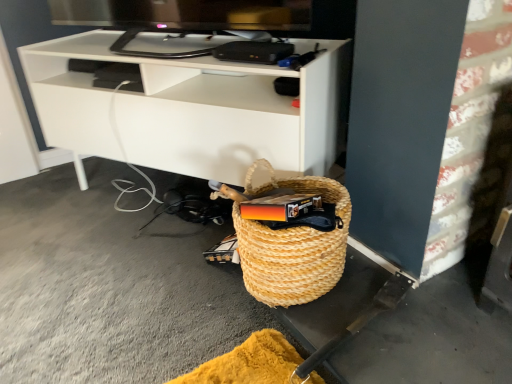
Question: Relative to white matte shelf at center, is woven straw basket at lower right in front or behind?

Choices:
 (A) behind
 (B) front

Answer: (B)

Question: Considering the positions of woven straw basket at lower right and white matte shelf at center in the image, is woven straw basket at lower right taller or shorter than white matte shelf at center?

Choices:
 (A) tall
 (B) short

Answer: (B)

Question: Is woven straw basket at lower right bigger or smaller than white matte shelf at center?

Choices:
 (A) big
 (B) small

Answer: (B)

Question: From the image's perspective, is white matte shelf at center above or below woven straw basket at lower right?

Choices:
 (A) above
 (B) below

Answer: (A)

Question: Looking at the image, does white matte shelf at center seem bigger or smaller compared to woven straw basket at lower right?

Choices:
 (A) big
 (B) small

Answer: (A)

Question: Considering the positions of white matte shelf at center and woven straw basket at lower right in the image, is white matte shelf at center taller or shorter than woven straw basket at lower right?

Choices:
 (A) short
 (B) tall

Answer: (B)

Question: Is point (339, 99) positioned closer to the camera than point (240, 221)?

Choices:
 (A) farther
 (B) closer

Answer: (A)